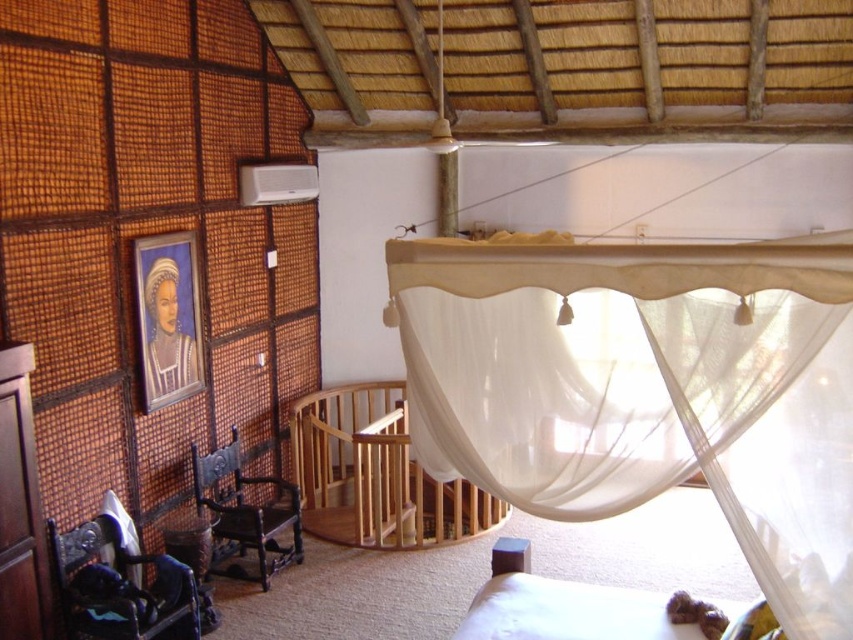
Question: Which point is farther to the camera?

Choices:
 (A) dark brown wood chair at left
 (B) metallic blue chair at lower left

Answer: (A)

Question: Does wooden crib at center have a larger size compared to metallic blue chair at lower left?

Choices:
 (A) yes
 (B) no

Answer: (A)

Question: Is white sheer curtain at center above metallic blue chair at lower left?

Choices:
 (A) yes
 (B) no

Answer: (A)

Question: In this image, where is wooden crib at center located relative to metallic blue chair at lower left?

Choices:
 (A) left
 (B) right

Answer: (B)

Question: Which point is farther to the camera?

Choices:
 (A) white sheer curtain at center
 (B) metallic blue chair at lower left
 (C) dark brown wood chair at left
 (D) wooden crib at center

Answer: (D)

Question: Which object is positioned farthest from the white sheer curtain at center?

Choices:
 (A) metallic blue chair at lower left
 (B) wooden crib at center
 (C) dark brown wood chair at left

Answer: (C)